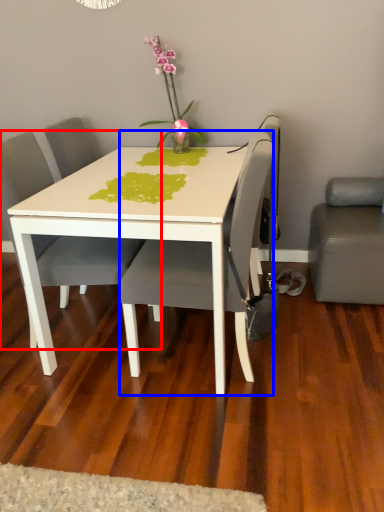
Question: Among these objects, which one is nearest to the camera, chair (highlighted by a red box) or chair (highlighted by a blue box)?

Choices:
 (A) chair
 (B) chair

Answer: (B)